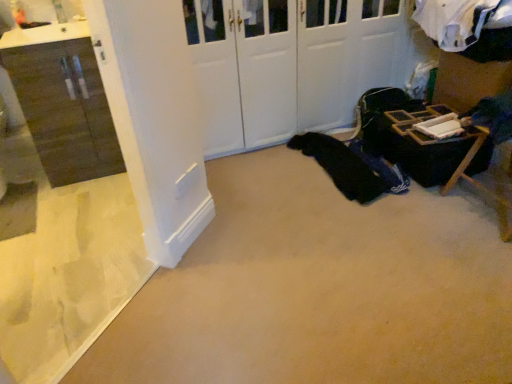
Question: Does matte brown cabinet at left have a larger size compared to black fabric at center?

Choices:
 (A) yes
 (B) no

Answer: (A)

Question: From a real-world perspective, is matte brown cabinet at left below black fabric at center?

Choices:
 (A) no
 (B) yes

Answer: (A)

Question: Could black fabric at center be considered to be inside matte brown cabinet at left?

Choices:
 (A) yes
 (B) no

Answer: (B)

Question: From the image's perspective, is matte brown cabinet at left beneath black fabric at center?

Choices:
 (A) yes
 (B) no

Answer: (B)

Question: Considering the relative sizes of matte brown cabinet at left and black fabric at center in the image provided, is matte brown cabinet at left shorter than black fabric at center?

Choices:
 (A) no
 (B) yes

Answer: (A)

Question: In the image, is white matte door at center positioned in front of or behind black fabric at center?

Choices:
 (A) front
 (B) behind

Answer: (A)

Question: From a real-world perspective, relative to black fabric at center, is white matte door at center vertically above or below?

Choices:
 (A) above
 (B) below

Answer: (A)

Question: From the image's perspective, is white matte door at center positioned above or below black fabric at center?

Choices:
 (A) below
 (B) above

Answer: (B)

Question: Considering the positions of white matte door at center and black fabric at center in the image, is white matte door at center bigger or smaller than black fabric at center?

Choices:
 (A) big
 (B) small

Answer: (A)

Question: Is white matte door at center wider or thinner than wooden folding table at lower right?

Choices:
 (A) wide
 (B) thin

Answer: (A)

Question: Would you say white matte door at center is to the left or to the right of wooden folding table at lower right in the picture?

Choices:
 (A) left
 (B) right

Answer: (A)

Question: In the image, is white matte door at center positioned in front of or behind wooden folding table at lower right?

Choices:
 (A) behind
 (B) front

Answer: (A)

Question: From a real-world perspective, is white matte door at center above or below wooden folding table at lower right?

Choices:
 (A) below
 (B) above

Answer: (B)

Question: Considering the positions of white matte door at center and matte brown cabinet at left in the image, is white matte door at center bigger or smaller than matte brown cabinet at left?

Choices:
 (A) small
 (B) big

Answer: (B)

Question: Considering the positions of white matte door at center and matte brown cabinet at left in the image, is white matte door at center taller or shorter than matte brown cabinet at left?

Choices:
 (A) tall
 (B) short

Answer: (A)